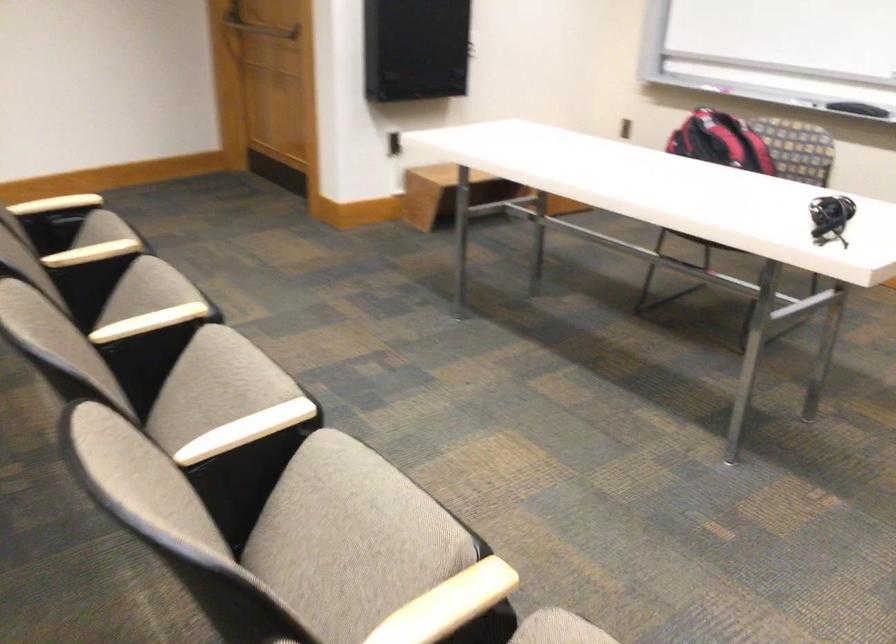
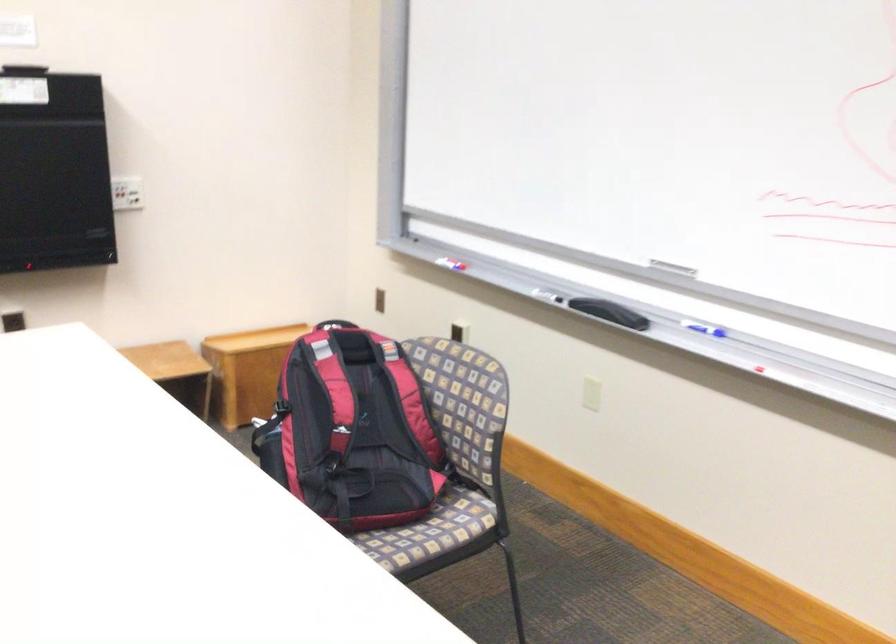
The point at (724, 136) is marked in the first image. Where is the corresponding point in the second image?

(334, 391)